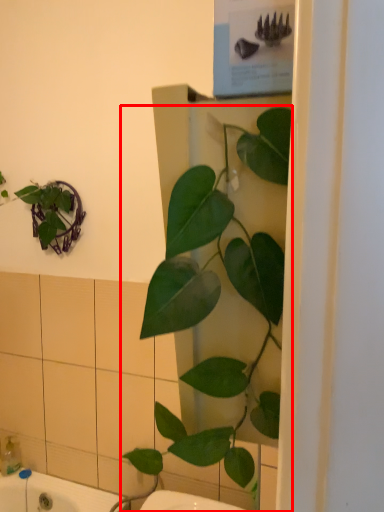
Question: From the image's perspective, what is the correct spatial relationship of houseplant (annotated by the red box) in relation to soap dispenser?

Choices:
 (A) above
 (B) below

Answer: (A)